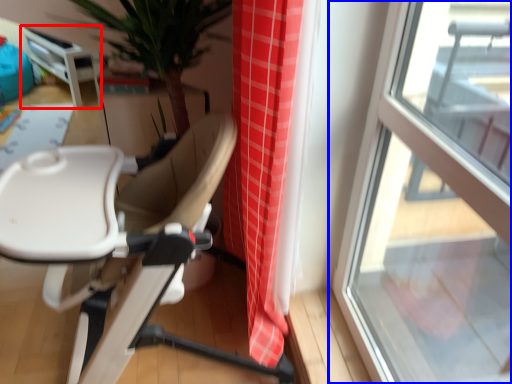
Question: Which object appears farthest to the camera in this image, table (highlighted by a red box) or window (highlighted by a blue box)?

Choices:
 (A) table
 (B) window

Answer: (A)